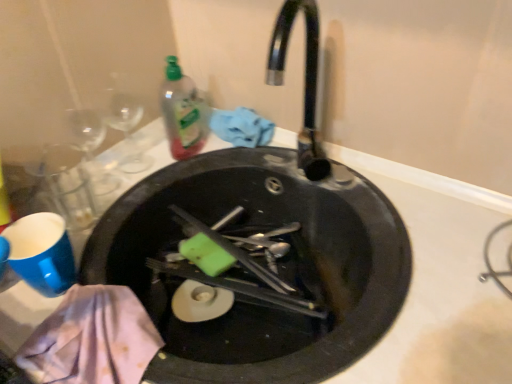
Image resolution: width=512 pixels, height=384 pixels. I want to click on unoccupied region to the right of translucent plastic bottle at upper center, so click(x=243, y=167).